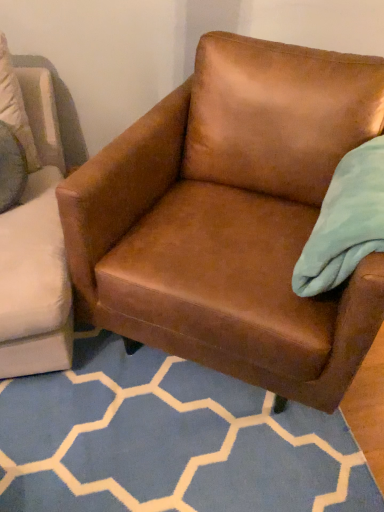
Measure the distance between brown leather armchair at center and camera.

The depth of brown leather armchair at center is 3.54 feet.

Describe the element at coordinates (169, 441) in the screenshot. The image size is (384, 512). I see `brown leather armchair at center` at that location.

This screenshot has width=384, height=512. I want to click on brown leather armchair at center, so click(169, 441).

What do you see at coordinates (232, 218) in the screenshot? I see `brown leather chair at center` at bounding box center [232, 218].

Locate an element on the screen. This screenshot has width=384, height=512. brown leather chair at center is located at coordinates (232, 218).

The height and width of the screenshot is (512, 384). What are the coordinates of `brown leather armchair at center` in the screenshot? It's located at (169, 441).

Considering the positions of objects brown leather armchair at center and brown leather chair at center in the image provided, who is more to the left, brown leather armchair at center or brown leather chair at center?

From the viewer's perspective, brown leather armchair at center appears more on the left side.

Is brown leather armchair at center positioned before brown leather chair at center?

No, brown leather armchair at center is behind brown leather chair at center.

Does point (356, 481) come behind point (245, 303)?

Yes, point (356, 481) is farther from viewer.

From the image's perspective, relative to brown leather chair at center, is brown leather armchair at center above or below?

brown leather armchair at center is situated lower than brown leather chair at center in the image.

From a real-world perspective, which is physically above, brown leather armchair at center or brown leather chair at center?

brown leather chair at center, from a real-world perspective.

From the picture: Which of these two, brown leather armchair at center or brown leather chair at center, is thinner?

Thinner between the two is brown leather armchair at center.

Does brown leather armchair at center have a greater height compared to brown leather chair at center?

Incorrect, the height of brown leather armchair at center is not larger of that of brown leather chair at center.

Can you confirm if brown leather armchair at center is smaller than brown leather chair at center?

Correct, brown leather armchair at center occupies less space than brown leather chair at center.

Could brown leather chair at center be considered to be inside brown leather armchair at center?

No.

Is brown leather armchair at center placed right next to brown leather chair at center?

No, brown leather armchair at center is not next to brown leather chair at center.

Is brown leather armchair at center facing towards brown leather chair at center?

Yes.

How distant is brown leather armchair at center from brown leather chair at center?

brown leather armchair at center is 18.33 inches from brown leather chair at center.

Locate an element on the screen. Image resolution: width=384 pixels, height=512 pixels. chair above the brown leather armchair at center (from the image's perspective) is located at coordinates (232, 218).

Which is more to the left, brown leather chair at center or brown leather armchair at center?

Positioned to the left is brown leather armchair at center.

Looking at this image, does brown leather chair at center come behind brown leather armchair at center?

No, brown leather chair at center is in front of brown leather armchair at center.

Does point (236, 170) appear closer or farther from the camera than point (134, 447)?

Point (236, 170).

From the image's perspective, between brown leather chair at center and brown leather armchair at center, who is located below?

brown leather armchair at center is shown below in the image.

From a real-world perspective, which object stands above the other?

brown leather chair at center, from a real-world perspective.

Does brown leather chair at center have a greater width compared to brown leather armchair at center?

Yes, brown leather chair at center is wider than brown leather armchair at center.

Considering the sizes of objects brown leather chair at center and brown leather armchair at center in the image provided, who is taller, brown leather chair at center or brown leather armchair at center?

brown leather chair at center.

Is brown leather chair at center bigger than brown leather armchair at center?

Indeed, brown leather chair at center has a larger size compared to brown leather armchair at center.

Is brown leather chair at center positioned beyond the bounds of brown leather armchair at center?

Yes.

From the picture: Is brown leather chair at center far away from brown leather armchair at center?

No.

Could you tell me if brown leather chair at center is turned towards brown leather armchair at center?

Yes, brown leather chair at center is facing brown leather armchair at center.

In the scene shown: How much distance is there between brown leather chair at center and brown leather armchair at center?

The distance of brown leather chair at center from brown leather armchair at center is 18.33 inches.

The width and height of the screenshot is (384, 512). What are the coordinates of `chair positioned vertically above the brown leather armchair at center (from a real-world perspective)` in the screenshot? It's located at (232, 218).

There is a brown leather armchair at center. Identify the location of chair above it (from a real-world perspective). (232, 218).

In the image, there is a brown leather chair at center. At what (x,y) coordinates should I click in order to perform the action: click on pattern below it (from the image's perspective). Please return your answer as a coordinate pair (x, y). Looking at the image, I should click on (169, 441).